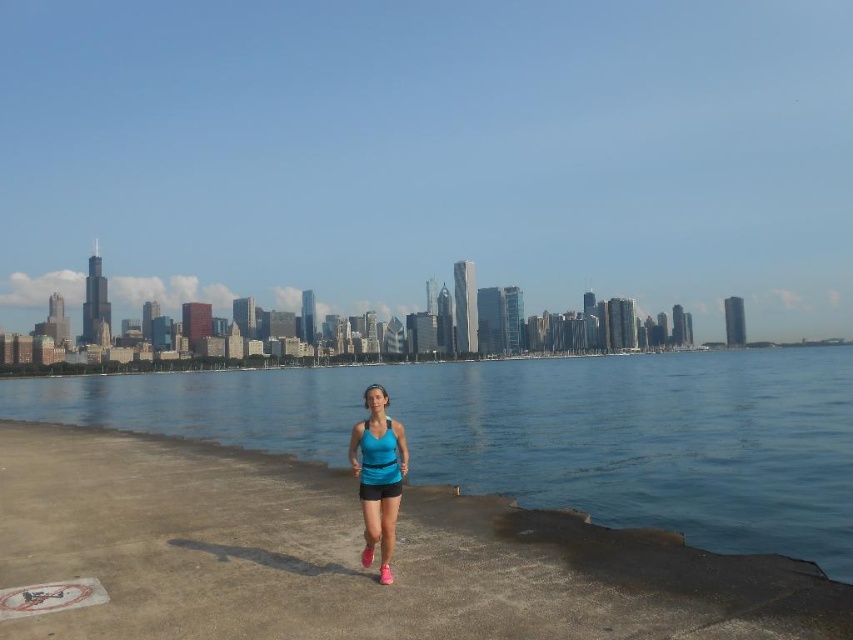
Is point (248, 376) more distant than point (393, 422)?

Yes, it is.

The width and height of the screenshot is (853, 640). Describe the element at coordinates (546, 433) in the screenshot. I see `blue water at center` at that location.

The height and width of the screenshot is (640, 853). Find the location of `blue water at center`. blue water at center is located at coordinates (546, 433).

What are the coordinates of `blue water at center` in the screenshot? It's located at (546, 433).